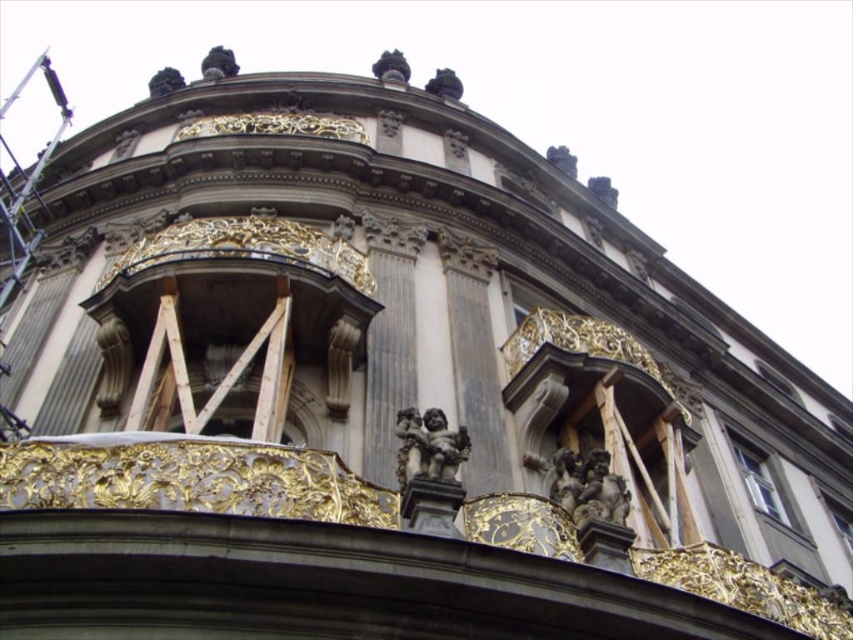
Question: Among these points, which one is farthest from the camera?

Choices:
 (A) (454, 465)
 (B) (612, 486)

Answer: (B)

Question: Does gray stone cherubim at center have a lesser width compared to polished bronze cherub at center?

Choices:
 (A) yes
 (B) no

Answer: (A)

Question: Which of the following is the closest to the observer?

Choices:
 (A) (621, 477)
 (B) (408, 452)

Answer: (B)

Question: Does gray stone cherubim at center appear over polished bronze cherub at center?

Choices:
 (A) no
 (B) yes

Answer: (A)

Question: Does gray stone cherubim at center have a larger size compared to polished bronze cherub at center?

Choices:
 (A) no
 (B) yes

Answer: (B)